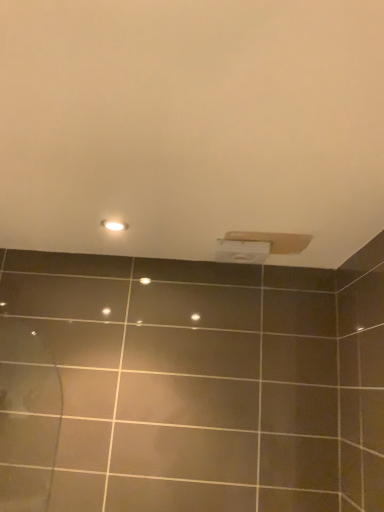
Question: Are matte white light fixture at upper center and white matte toilet paper at upper center far apart?

Choices:
 (A) no
 (B) yes

Answer: (A)

Question: Can you confirm if matte white light fixture at upper center is positioned to the right of white matte toilet paper at upper center?

Choices:
 (A) yes
 (B) no

Answer: (B)

Question: Can you confirm if matte white light fixture at upper center is bigger than white matte toilet paper at upper center?

Choices:
 (A) yes
 (B) no

Answer: (B)

Question: From a real-world perspective, is matte white light fixture at upper center on white matte toilet paper at upper center?

Choices:
 (A) no
 (B) yes

Answer: (B)

Question: Does matte white light fixture at upper center appear on the left side of white matte toilet paper at upper center?

Choices:
 (A) yes
 (B) no

Answer: (A)

Question: From the image's perspective, is matte white light fixture at upper center located above white matte toilet paper at upper center?

Choices:
 (A) yes
 (B) no

Answer: (A)

Question: Is white matte toilet paper at upper center outside matte white light fixture at upper center?

Choices:
 (A) yes
 (B) no

Answer: (A)

Question: Is white matte toilet paper at upper center bigger than matte white light fixture at upper center?

Choices:
 (A) no
 (B) yes

Answer: (B)

Question: Would you consider white matte toilet paper at upper center to be distant from matte white light fixture at upper center?

Choices:
 (A) no
 (B) yes

Answer: (A)

Question: From the image's perspective, does white matte toilet paper at upper center appear lower than matte white light fixture at upper center?

Choices:
 (A) no
 (B) yes

Answer: (B)

Question: Is white matte toilet paper at upper center oriented away from matte white light fixture at upper center?

Choices:
 (A) yes
 (B) no

Answer: (B)

Question: From a real-world perspective, is white matte toilet paper at upper center physically above matte white light fixture at upper center?

Choices:
 (A) no
 (B) yes

Answer: (A)

Question: From a real-world perspective, is white matte toilet paper at upper center above or below matte white light fixture at upper center?

Choices:
 (A) below
 (B) above

Answer: (A)